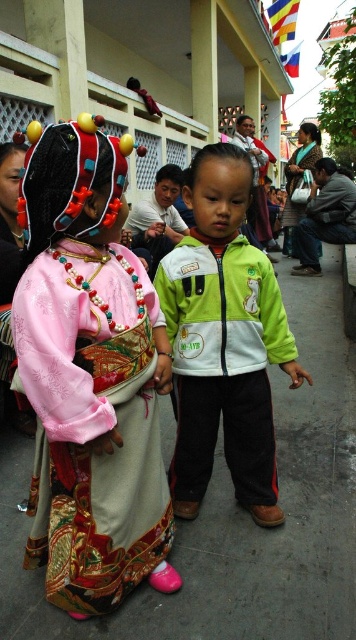
You are standing at the point with coordinates point (255, 179) and want to walk towards the point with coordinates point (223, 371). Which direction should you move?

You should move forward because point (223, 371) is in front of point (255, 179) from your current position.